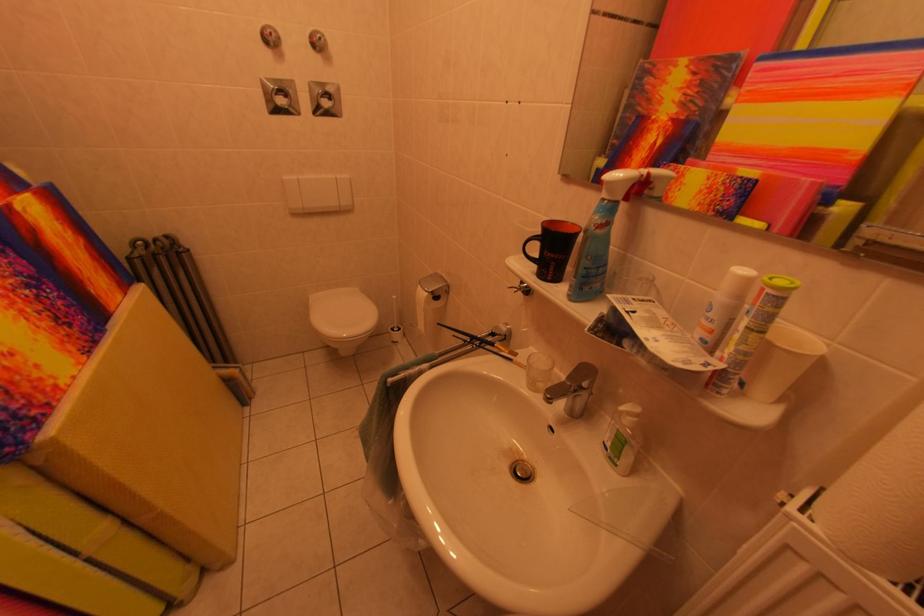
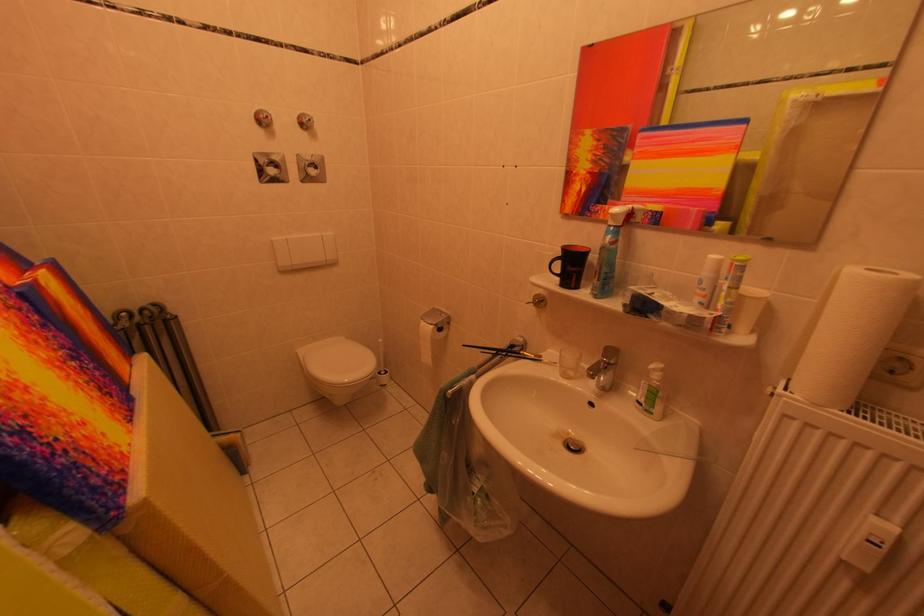
Question: How did the camera likely rotate?

Choices:
 (A) Left
 (B) Right
 (C) Up
 (D) Down

Answer: (B)